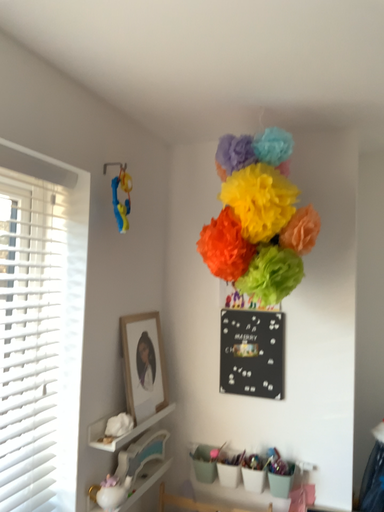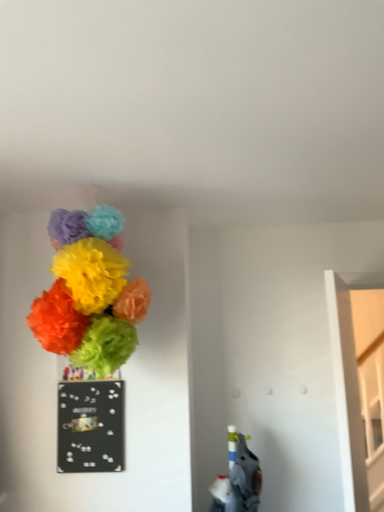
Question: How did the camera likely rotate when shooting the video?

Choices:
 (A) rotated downward
 (B) rotated upward

Answer: (B)